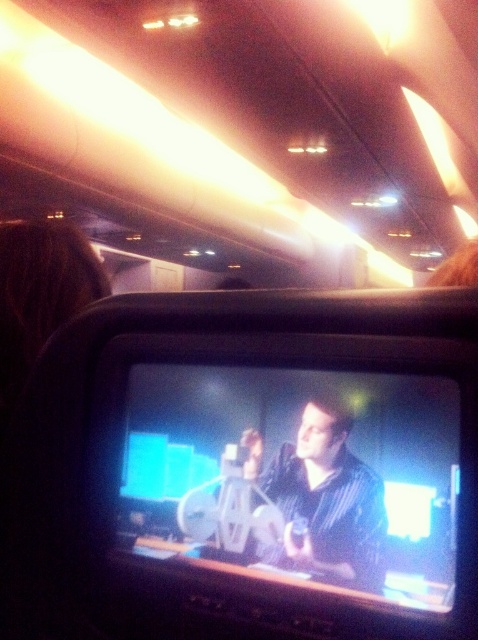
Is matte black monitor at center above matte black shirt at center?

Yes, matte black monitor at center is above matte black shirt at center.

Does matte black monitor at center have a larger size compared to matte black shirt at center?

Correct, matte black monitor at center is larger in size than matte black shirt at center.

Is point (442, 458) closer to viewer compared to point (355, 538)?

Yes, it is in front of point (355, 538).

Find the location of `matte black monitor at center`. matte black monitor at center is located at coordinates (300, 474).